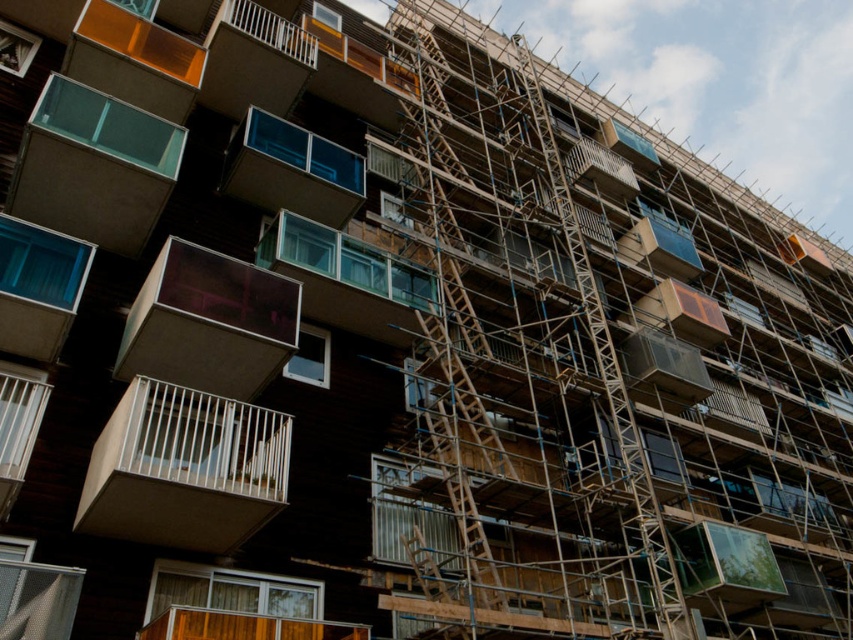
Which is more to the left, white matte balcony at center or wooden scaffolding at center?

white matte balcony at center

Between point (135, 513) and point (566, 237), which one is positioned in front?

Positioned in front is point (135, 513).

The width and height of the screenshot is (853, 640). Identify the location of white matte balcony at center. (184, 468).

Identify the location of white matte balcony at center. (184, 468).

How distant is wooden scaffolding at center from translucent glass balcony at center?

A distance of 16.36 meters exists between wooden scaffolding at center and translucent glass balcony at center.

Is point (456, 314) more distant than point (241, 164)?

Yes, point (456, 314) is farther from viewer.

Where is `wooden scaffolding at center`? Image resolution: width=853 pixels, height=640 pixels. wooden scaffolding at center is located at coordinates (610, 378).

Is point (283, 435) farther from camera compared to point (306, 180)?

No, it is in front of (306, 180).

Can you confirm if white matte balcony at center is positioned to the right of translucent glass balcony at center?

In fact, white matte balcony at center is to the left of translucent glass balcony at center.

Is point (252, 525) positioned before point (314, 214)?

Yes, it is.

Where is `white matte balcony at center`? white matte balcony at center is located at coordinates (184, 468).